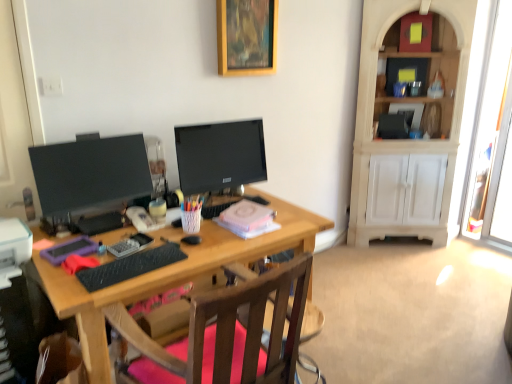
Question: Is clear plastic tray at center, the 2th stationery from the right, inside the boundaries of matte black monitor at left, the 1th television positioned from the left, or outside?

Choices:
 (A) outside
 (B) inside

Answer: (A)

Question: From the image's perspective, is clear plastic tray at center, the 2th stationery from the right, positioned above or below matte black monitor at left, the 1th television positioned from the left?

Choices:
 (A) above
 (B) below

Answer: (B)

Question: Estimate the real-world distances between objects in this image. Which object is farther from the black plastic computer tower at lower left?

Choices:
 (A) clear plastic tray at center, the 2th stationery from the right
 (B) wooden desk at center
 (C) white woven pen holder at center, acting as the 1th stationery starting from the right
 (D) black rubberized keyboard at center
 (E) matte black monitor at left, the 1th television positioned from the left

Answer: (C)

Question: Estimate the real-world distances between objects in this image. Which object is farther from the black rubberized keyboard at center?

Choices:
 (A) black plastic computer tower at lower left
 (B) white woven pen holder at center, acting as the 1th stationery starting from the right
 (C) wooden picture frame at upper center
 (D) clear plastic tray at center, the 2th stationery viewed from the left
 (E) wooden desk at center

Answer: (C)